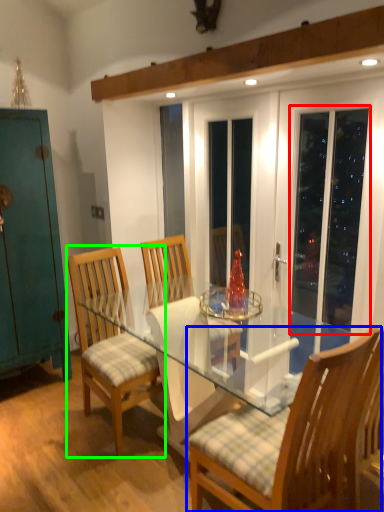
Question: Considering the real-world distances, which object is closest to screen door (highlighted by a red box)? chair (highlighted by a blue box) or chair (highlighted by a green box).

Choices:
 (A) chair
 (B) chair

Answer: (A)